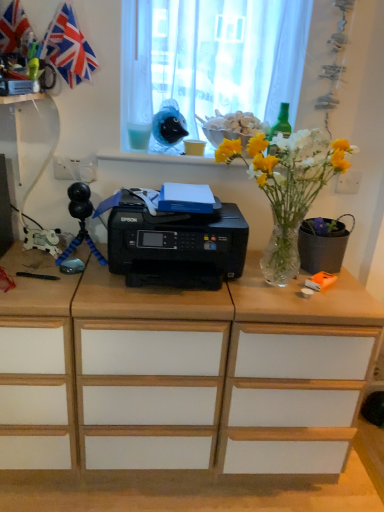
This screenshot has width=384, height=512. What are the coordinates of `vacant space situated on the left part of black matte flowerpot at right` in the screenshot? It's located at (264, 274).